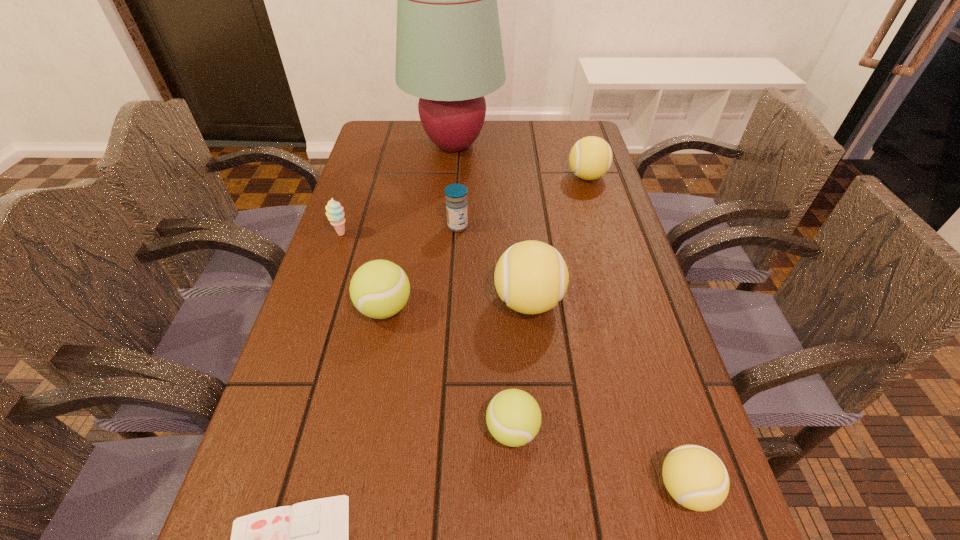
This screenshot has width=960, height=540. What are the coordinates of `vacant space located on the back of the smallest yellow tennis ball` in the screenshot? It's located at (635, 322).

The height and width of the screenshot is (540, 960). What are the coordinates of `vacant space located on the back of the right green tennis ball` in the screenshot? It's located at (510, 381).

Where is `object at the far edge`? This screenshot has height=540, width=960. object at the far edge is located at coordinates (449, 53).

Image resolution: width=960 pixels, height=540 pixels. Find the location of `lampshade present at the left edge`. lampshade present at the left edge is located at coordinates (449, 53).

Find the location of a particular element. The width and height of the screenshot is (960, 540). tennis ball positioned at the left edge is located at coordinates tap(379, 289).

Where is `sherbert present at the left edge`? sherbert present at the left edge is located at coordinates (334, 211).

Locate an element on the screen. object present at the far left corner is located at coordinates (449, 53).

The height and width of the screenshot is (540, 960). I want to click on blank space at the far edge of the desktop, so click(x=419, y=139).

I want to click on vacant space at the left edge of the desktop, so click(294, 360).

Identify the location of vacant space at the right edge of the desktop. The image size is (960, 540). (604, 267).